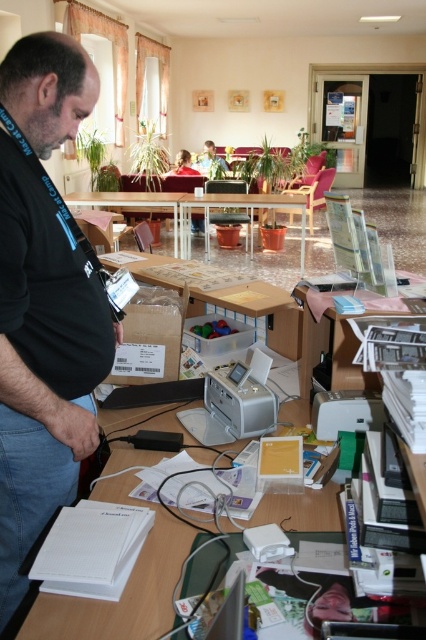
How much distance is there between silver/plastic printer at center and clear glass table at center?

They are 4.15 meters apart.

Between point (212, 376) and point (132, 202), which one is positioned behind?

Point (132, 202)

Identify the location of silver/plastic printer at center. The height and width of the screenshot is (640, 426). (233, 403).

Can you confirm if wooden table at center is smaller than clear glass table at center?

Indeed, wooden table at center has a smaller size compared to clear glass table at center.

Is wooden table at center below clear glass table at center?

Indeed, wooden table at center is positioned under clear glass table at center.

Describe the element at coordinates (221, 296) in the screenshot. The image size is (426, 640). I see `wooden table at center` at that location.

Locate an element on the screen. wooden table at center is located at coordinates (221, 296).

Does point (368, 426) come in front of point (161, 193)?

Yes, it is.

Consider the image. Does white plastic printer at center have a lesser height compared to clear glass table at center?

Correct, white plastic printer at center is not as tall as clear glass table at center.

Is point (374, 422) closer to viewer compared to point (155, 193)?

Yes, it is.

Where is `white plastic printer at center`? white plastic printer at center is located at coordinates tap(345, 412).